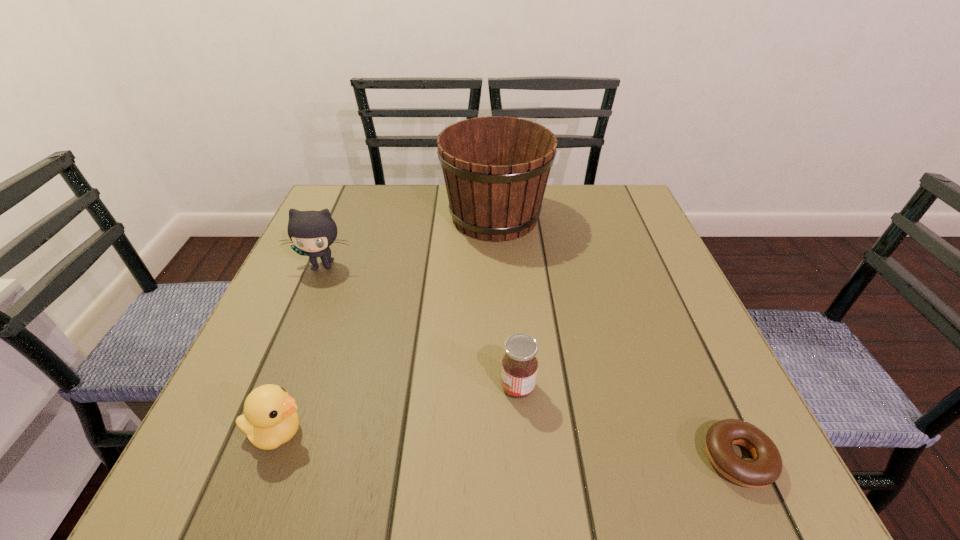
The width and height of the screenshot is (960, 540). I want to click on empty location between the kitten and the third nearest object, so click(420, 326).

Locate an element on the screen. The image size is (960, 540). vacant area that lies between the farthest object and the shortest object is located at coordinates (616, 338).

Identify the location of blank region between the duck and the jam. The width and height of the screenshot is (960, 540). (397, 410).

Identify the location of free space between the tallest object and the fourth shortest object. (409, 241).

Find the location of a particular element. This screenshot has height=540, width=960. vacant space that is in between the wine bucket and the duck is located at coordinates click(386, 325).

The width and height of the screenshot is (960, 540). I want to click on free space between the second farthest object and the tallest object, so click(409, 241).

Where is `free spot between the duck and the wine bucket`? Image resolution: width=960 pixels, height=540 pixels. free spot between the duck and the wine bucket is located at coordinates (386, 325).

At what (x,y) coordinates should I click in order to perform the action: click on free spot between the duck and the jam. Please return your answer as a coordinate pair (x, y). Looking at the image, I should click on (397, 410).

The width and height of the screenshot is (960, 540). Find the location of `the second closest object to the farthest object`. the second closest object to the farthest object is located at coordinates (519, 369).

Locate an element on the screen. This screenshot has height=540, width=960. object identified as the closest to the duck is located at coordinates (519, 369).